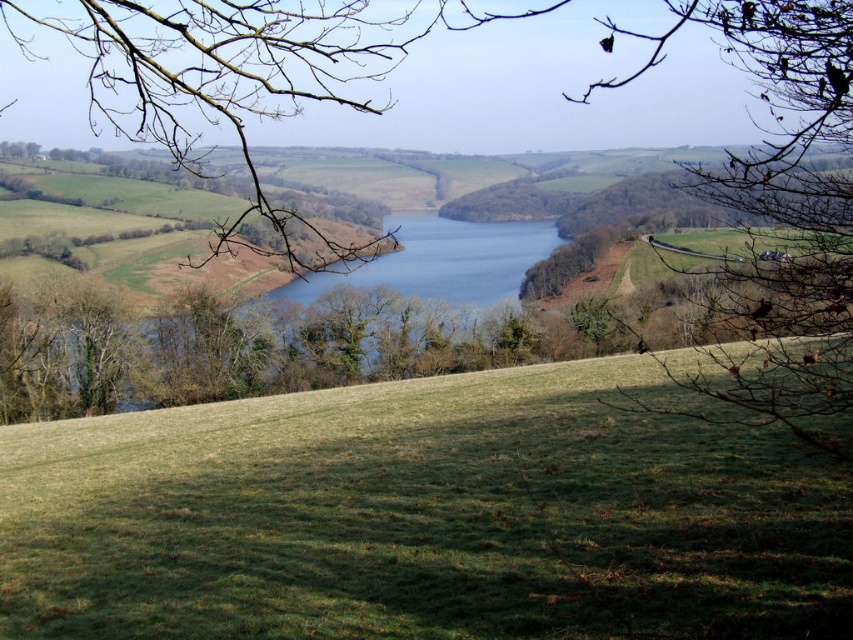
Based on the photo, you are standing on the green grassy hillside at center and want to reach the brown leafless branch at upper center. Which direction should you move to get closer to the branch?

You should move upward because the brown leafless branch at upper center is higher than the green grassy hillside at center.

You are planning to set up a small tent on the green grassy hillside at center. Considering the space available, will the tent require more space than the brown leafless branch at upper center occupies?

The green grassy hillside at center is narrower than the brown leafless branch at upper center, so the tent would need more space than what the hillside offers. Choose a wider area instead.